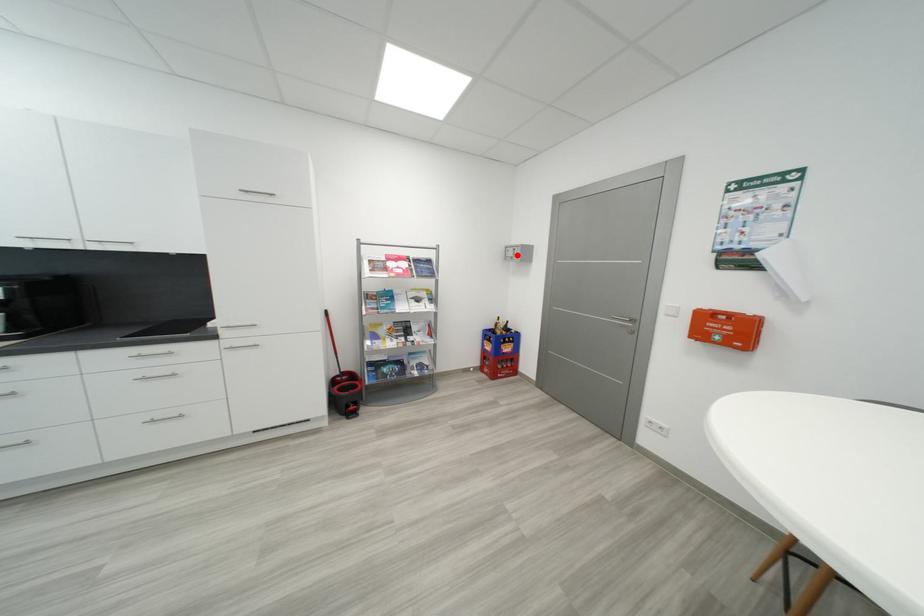
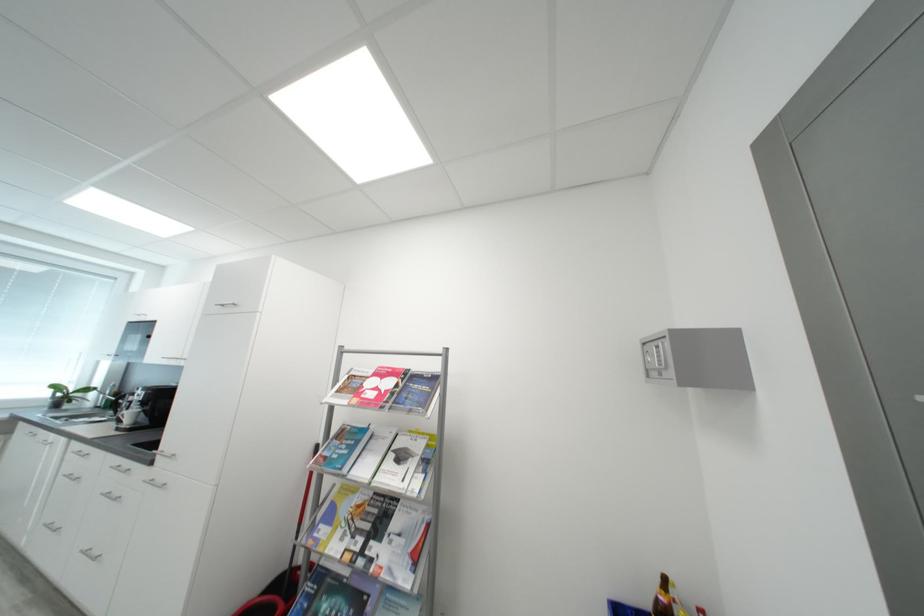
Where in the second image is the point corresponding to the highlighted location from the first image?

(660, 361)